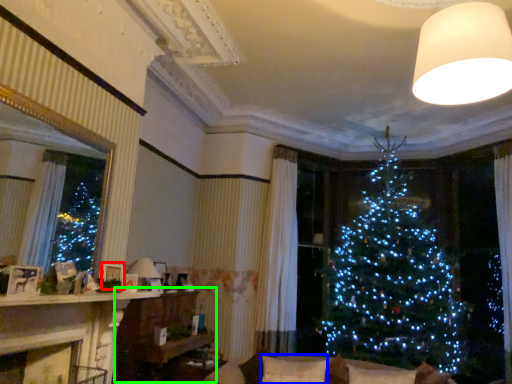
Question: Based on their relative distances, which object is nearer to picture frame (highlighted by a red box)? Choose from pillow (highlighted by a blue box) and furniture (highlighted by a green box).

Choices:
 (A) pillow
 (B) furniture

Answer: (B)